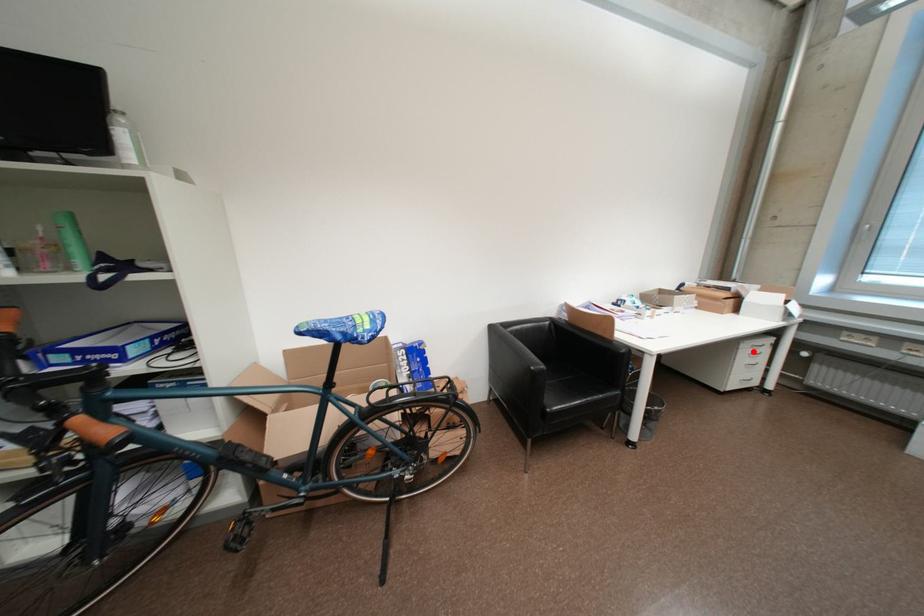
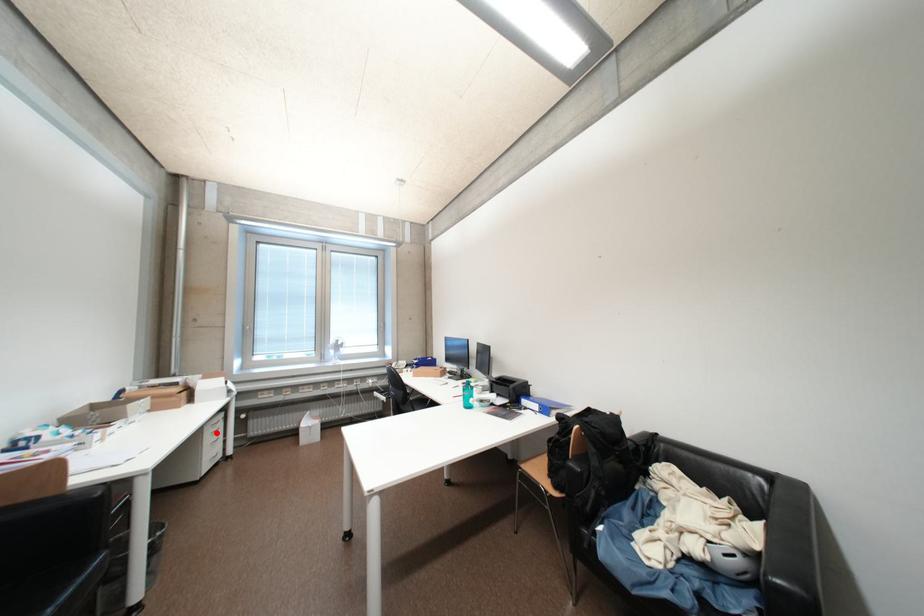
I am providing you with two images of the same scene from different viewpoints. A red point is marked on the first image and another point is marked on the second image. Is the marked point in image1 the same physical position as the marked point in image2?

Yes